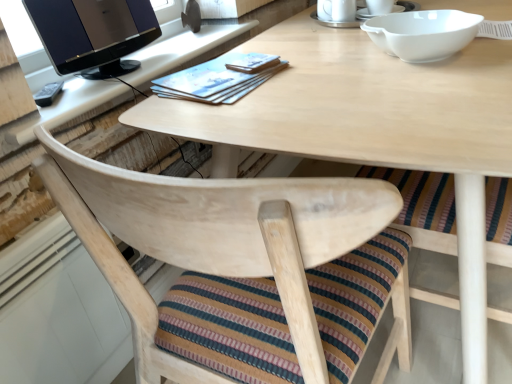
This screenshot has height=384, width=512. Find the location of `vacant space situated on the left part of white glossy bowl at upper right`. vacant space situated on the left part of white glossy bowl at upper right is located at coordinates (313, 73).